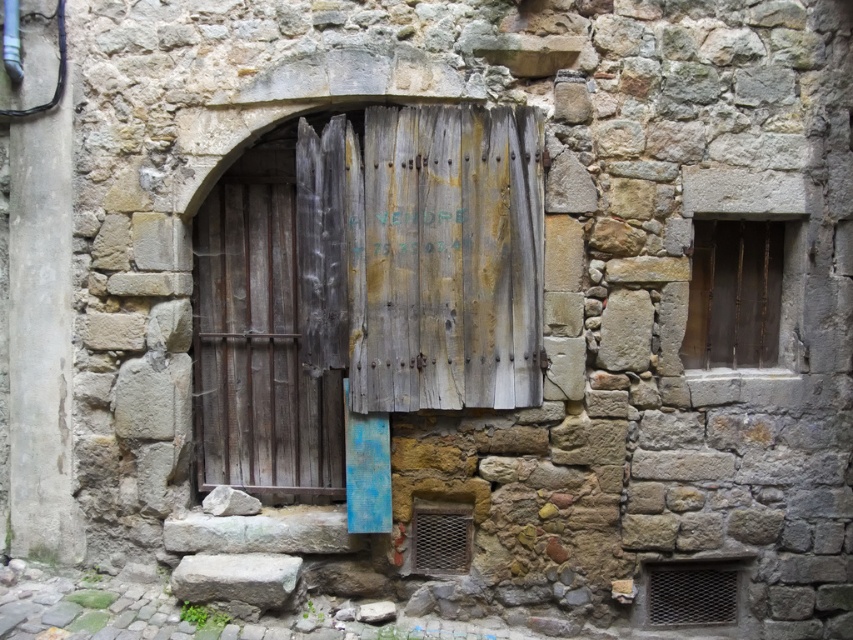
Does weathered wood door at center appear on the left side of gray rough stone at lower left?

Incorrect, weathered wood door at center is not on the left side of gray rough stone at lower left.

Image resolution: width=853 pixels, height=640 pixels. Describe the element at coordinates (273, 317) in the screenshot. I see `weathered wood door at center` at that location.

This screenshot has height=640, width=853. I want to click on weathered wood door at center, so click(x=273, y=317).

Does wooden bars at right lie in front of gray rough stone at lower left?

No, it is not.

What do you see at coordinates (734, 294) in the screenshot? I see `wooden bars at right` at bounding box center [734, 294].

What are the coordinates of `wooden bars at right` in the screenshot? It's located at (734, 294).

At what (x,y) coordinates should I click in order to perform the action: click on weathered wood door at center. Please return your answer as a coordinate pair (x, y). Looking at the image, I should click on (273, 317).

Measure the distance between weathered wood door at center and camera.

They are 3.74 meters apart.

Where is `weathered wood door at center`? The image size is (853, 640). weathered wood door at center is located at coordinates (273, 317).

Identify the location of weathered wood door at center. [273, 317].